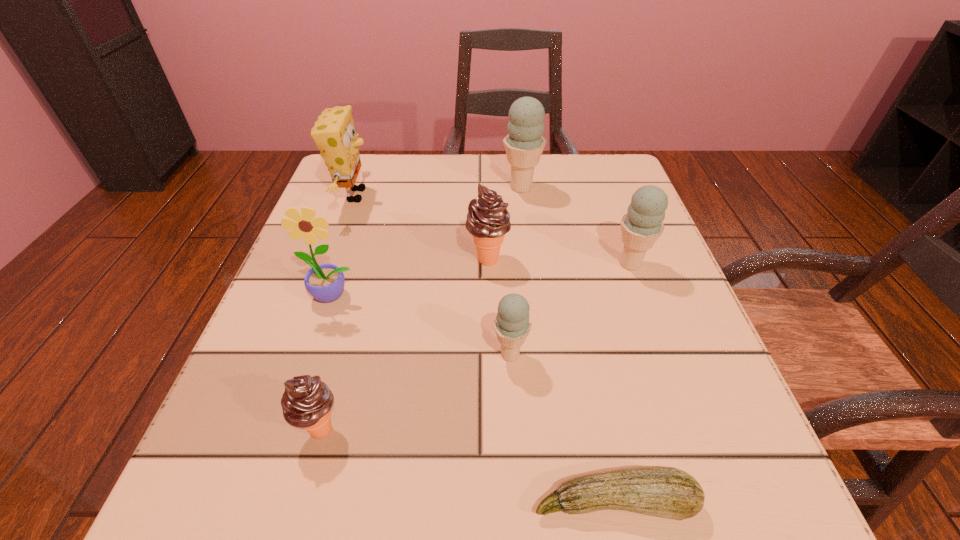
Identify the location of object located in the near right corner section of the desktop. The height and width of the screenshot is (540, 960). (666, 492).

Image resolution: width=960 pixels, height=540 pixels. In the image, there is a desktop. Find the location of `free region at the far edge`. free region at the far edge is located at coordinates (552, 202).

In the image, there is a desktop. In order to click on vacant area at the near edge in this screenshot , I will do `click(519, 477)`.

Identify the location of vacant space at the left edge of the desktop. Image resolution: width=960 pixels, height=540 pixels. (356, 338).

The image size is (960, 540). Find the location of `vacant space at the right edge of the desktop`. vacant space at the right edge of the desktop is located at coordinates (636, 360).

Identify the location of free space at the near left corner of the desktop. (309, 529).

Image resolution: width=960 pixels, height=540 pixels. What are the coordinates of `free location at the far right corner` in the screenshot? It's located at (571, 201).

You are a GUI agent. You are given a task and a screenshot of the screen. Output one action in this format:
    pyautogui.click(x=<x>, y=<y>)
    Task: Click on the vacant space at the near right corner of the desktop
    
    Given the screenshot: What is the action you would take?
    pyautogui.click(x=757, y=519)

Image resolution: width=960 pixels, height=540 pixels. What are the coordinates of `unoccupied area between the yellow sponge and the nearest blue ice cream` in the screenshot? It's located at (433, 275).

At what (x,y) coordinates should I click in order to perform the action: click on free space between the farther chocolate icecream and the shortest object. Please return your answer as a coordinate pair (x, y). The width and height of the screenshot is (960, 540). Looking at the image, I should click on (551, 380).